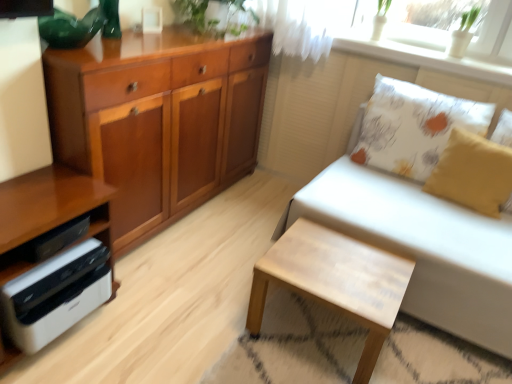
Question: Is green leafy plant at upper center not near white printed cushion at upper right, positioned as the 1th pillow in back-to-front order?

Choices:
 (A) yes
 (B) no

Answer: (A)

Question: Is the surface of green leafy plant at upper center in direct contact with white printed cushion at upper right, the second pillow viewed from the front?

Choices:
 (A) yes
 (B) no

Answer: (B)

Question: Is green leafy plant at upper center in front of white printed cushion at upper right, the second pillow viewed from the front?

Choices:
 (A) no
 (B) yes

Answer: (A)

Question: Does green leafy plant at upper center appear on the right side of white printed cushion at upper right, positioned as the 1th pillow in back-to-front order?

Choices:
 (A) yes
 (B) no

Answer: (B)

Question: Considering the relative sizes of green leafy plant at upper center and white printed cushion at upper right, the second pillow viewed from the front, in the image provided, is green leafy plant at upper center thinner than white printed cushion at upper right, the second pillow viewed from the front,?

Choices:
 (A) no
 (B) yes

Answer: (A)

Question: Does point (109, 72) appear closer or farther from the camera than point (499, 64)?

Choices:
 (A) farther
 (B) closer

Answer: (B)

Question: Is wooden cabinet at left bigger or smaller than white textured cushion at upper right?

Choices:
 (A) small
 (B) big

Answer: (B)

Question: Is wooden cabinet at left situated inside white textured cushion at upper right or outside?

Choices:
 (A) inside
 (B) outside

Answer: (B)

Question: In the image, is wooden cabinet at left positioned in front of or behind white textured cushion at upper right?

Choices:
 (A) behind
 (B) front

Answer: (B)

Question: Considering the positions of yellow fabric pillow at right, which appears as the 2th pillow when viewed from the back, and white leather stool at lower right in the image, is yellow fabric pillow at right, which appears as the 2th pillow when viewed from the back, taller or shorter than white leather stool at lower right?

Choices:
 (A) tall
 (B) short

Answer: (A)

Question: Considering the positions of point (451, 175) and point (368, 332), is point (451, 175) closer or farther from the camera than point (368, 332)?

Choices:
 (A) farther
 (B) closer

Answer: (A)

Question: Considering the relative positions of yellow fabric pillow at right, which appears as the 2th pillow when viewed from the back, and white leather stool at lower right in the image provided, is yellow fabric pillow at right, which appears as the 2th pillow when viewed from the back, to the left or to the right of white leather stool at lower right?

Choices:
 (A) left
 (B) right

Answer: (B)

Question: From a real-world perspective, is yellow fabric pillow at right, the first pillow from the front, above or below white leather stool at lower right?

Choices:
 (A) above
 (B) below

Answer: (A)

Question: From a real-world perspective, relative to white glossy printer at lower left, is yellow fabric pillow at right, the first pillow from the front, vertically above or below?

Choices:
 (A) below
 (B) above

Answer: (B)

Question: Considering the positions of yellow fabric pillow at right, the first pillow from the front, and white glossy printer at lower left in the image, is yellow fabric pillow at right, the first pillow from the front, bigger or smaller than white glossy printer at lower left?

Choices:
 (A) small
 (B) big

Answer: (A)